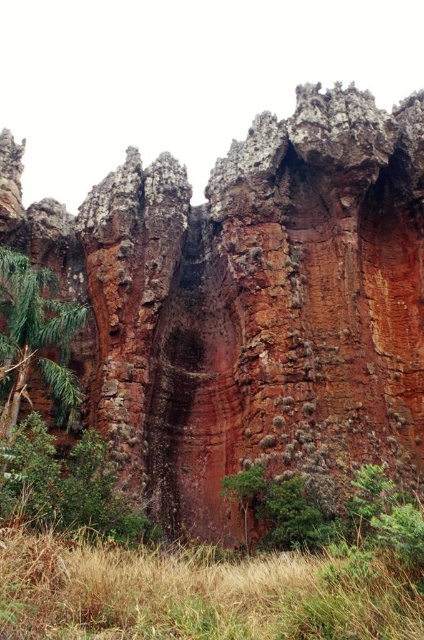
You are a hiker trying to navigate through the landscape. You see the brown dry grass at lower center and the green leafy tree at left. How far apart are these two landmarks?

The brown dry grass at lower center is 27.16 meters from the green leafy tree at left.

You are a hiker trying to navigate through the area. You see the rusty rock cliff at center and the green leafy tree at left. Which object is higher up in the landscape?

The rusty rock cliff at center is located above the green leafy tree at left, so it is higher up in the landscape.

You are planning to set up a campsite in this area. You have a tent that requires a minimum of 5 meters of space to set up. Based on the image, can you determine if the rusty rock cliff at center and the green leafy tree at left provide enough space between them for your tent?

The rusty rock cliff at center is wider than the green leafy tree at left. However, the exact distance between them isn